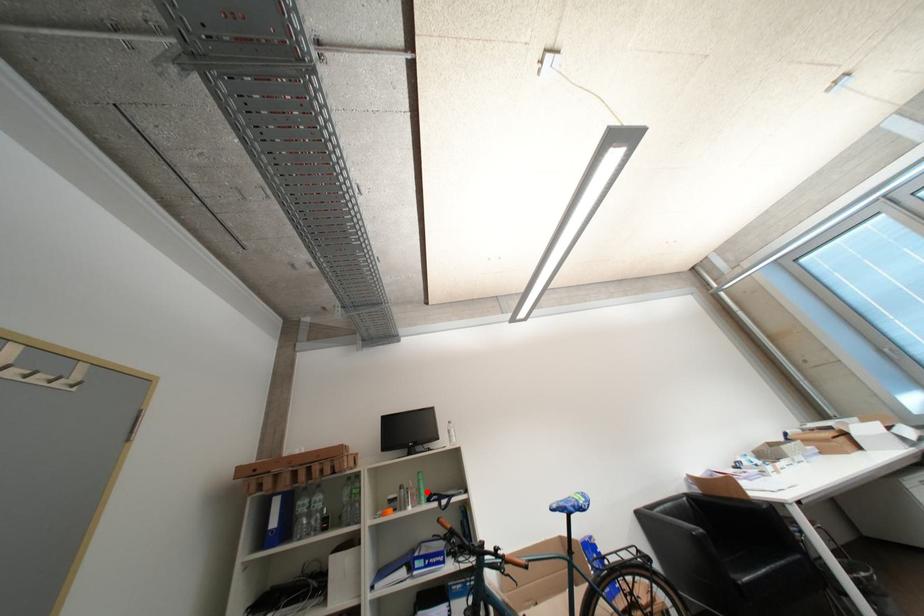
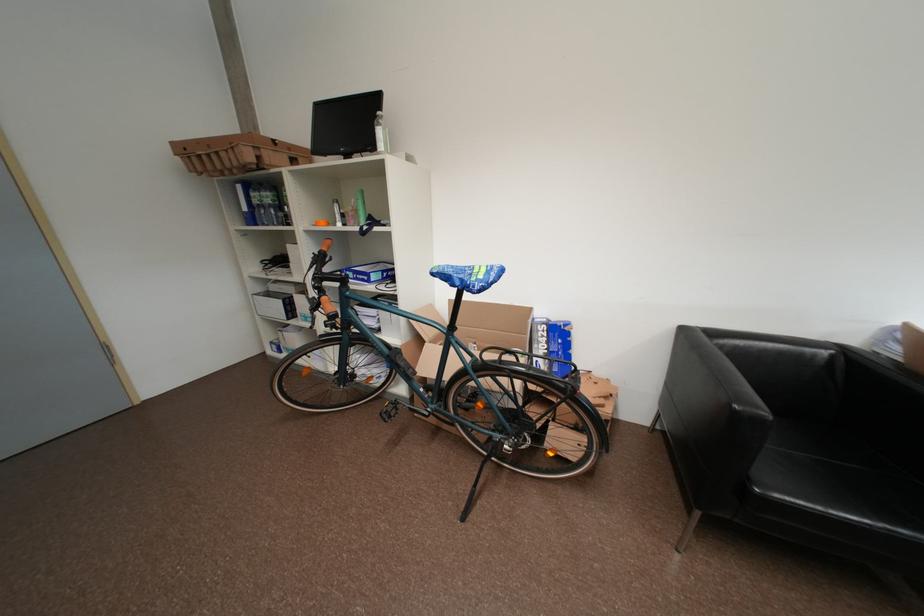
Question: I am providing you with two images of the same scene from different viewpoints. Image1 has a red point marked. In image2, the corresponding 3D location appears at what relative position? Reply with the corresponding letter.

Choices:
 (A) Closer
 (B) Farther

Answer: (A)